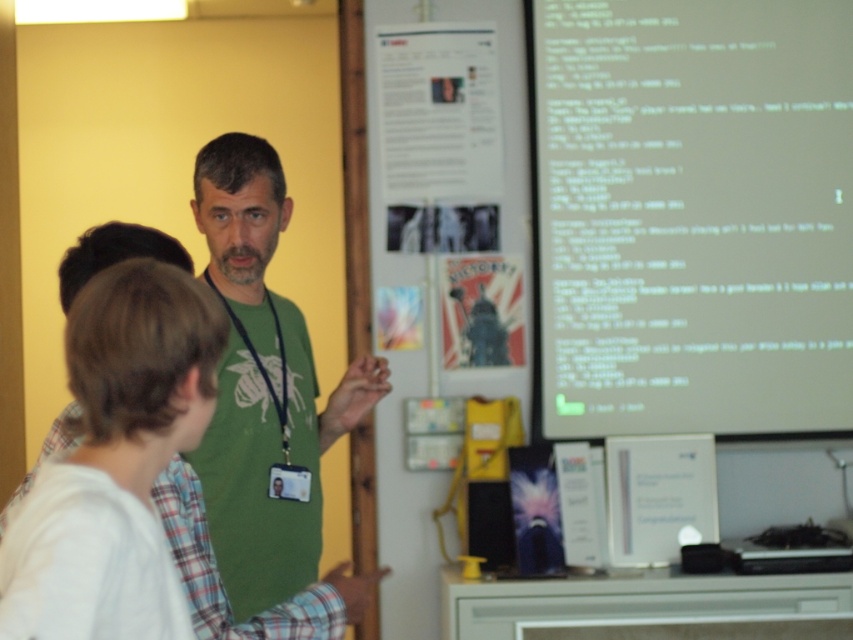
Question: Among these objects, which one is nearest to the camera?

Choices:
 (A) matte paper poster at center
 (B) green matte shirt at center
 (C) green text on white paper at upper right

Answer: (B)

Question: Observing the image, what is the correct spatial positioning of green text on white paper at upper right in reference to green matte shirt at center?

Choices:
 (A) above
 (B) below

Answer: (A)

Question: Is green text on white paper at upper right bigger than matte paper poster at center?

Choices:
 (A) yes
 (B) no

Answer: (A)

Question: Which of the following is the closest to the observer?

Choices:
 (A) (450, 294)
 (B) (727, 154)
 (C) (271, 451)

Answer: (C)

Question: Does green text on white paper at upper right appear under green matte shirt at center?

Choices:
 (A) yes
 (B) no

Answer: (B)

Question: Estimate the real-world distances between objects in this image. Which object is closer to the green matte shirt at center?

Choices:
 (A) green text on white paper at upper right
 (B) matte paper poster at center

Answer: (B)